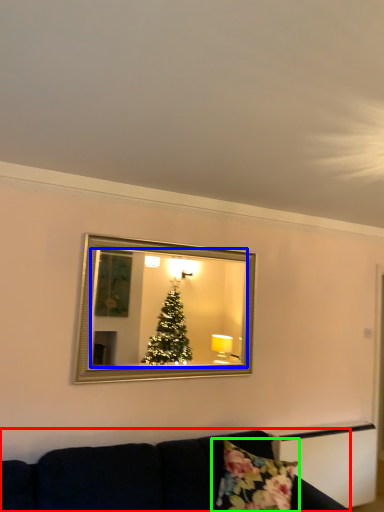
Question: Considering the real-world distances, which object is closest to studio couch (highlighted by a red box)? mirror (highlighted by a blue box) or pillow (highlighted by a green box).

Choices:
 (A) mirror
 (B) pillow

Answer: (B)